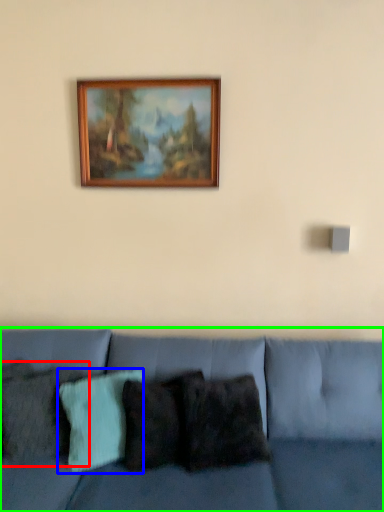
Question: Which object is positioned closest to pillow (highlighted by a red box)? Select from pillow (highlighted by a blue box) and studio couch (highlighted by a green box).

Choices:
 (A) pillow
 (B) studio couch

Answer: (A)